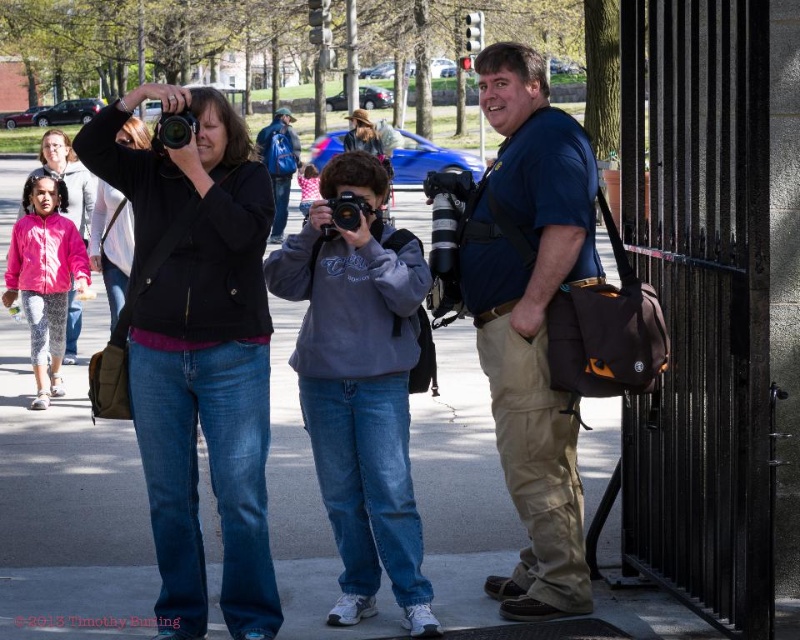
From the picture: Based on the coordinates provided in the Objects Description, which object is located at point (68, 177)?

The pink fleece jacket at left is located at point (68, 177).

You are a photographer standing behind the woman with the camera. You want to take a picture of the gray fleece sweatshirt at center and the blue backpack at center. Which object should you focus on first to ensure both are in the frame?

You should focus on the gray fleece sweatshirt at center first because it is closer to the viewer than the blue backpack at center, so adjusting the focus starting from the closer object ensures both are in the frame.

You are a photographer trying to capture a candid shot of the gray fleece sweatshirt at center without the matte black camera at center obstructing the view. Is this possible given their current positions?

The gray fleece sweatshirt at center is positioned under the matte black camera at center, so the camera is blocking the direct line of sight to the sweatshirt. To capture the sweatshirt without obstruction, you would need to adjust your angle or have the subject move slightly.